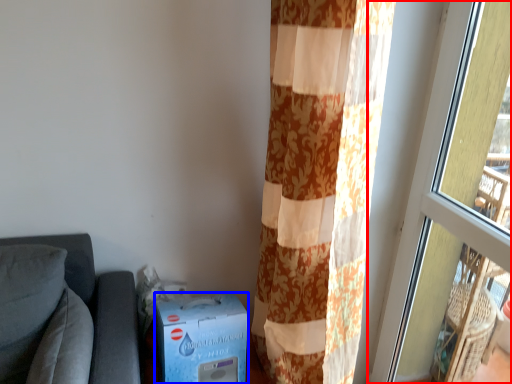
Question: Among these objects, which one is nearest to the camera, window (highlighted by a red box) or cardboard box (highlighted by a blue box)?

Choices:
 (A) window
 (B) cardboard box

Answer: (A)